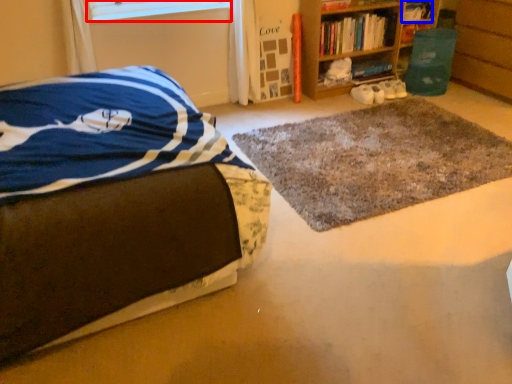
Question: Which point is further to the camera, window screen (highlighted by a red box) or book (highlighted by a blue box)?

Choices:
 (A) window screen
 (B) book

Answer: (B)